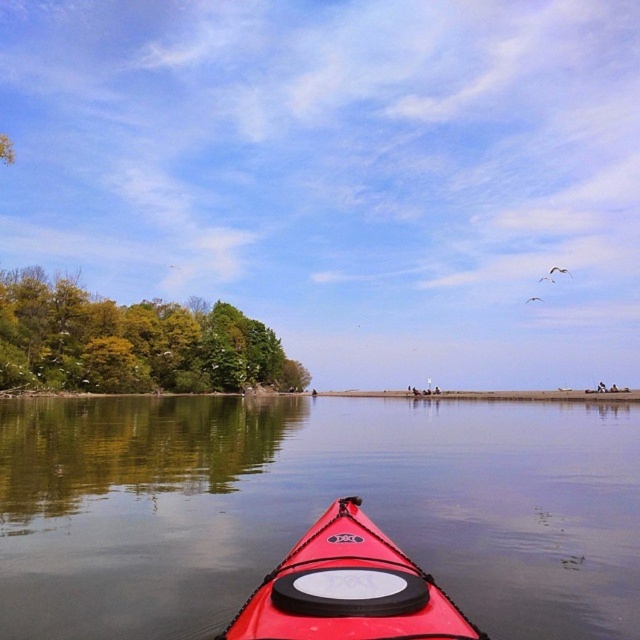
Question: Does red plastic kayak at center have a smaller size compared to green leafy trees at left?

Choices:
 (A) yes
 (B) no

Answer: (A)

Question: Can you confirm if red plastic kayak at center is wider than green leafy trees at left?

Choices:
 (A) yes
 (B) no

Answer: (A)

Question: Which of the following is the farthest from the observer?

Choices:
 (A) (90, 552)
 (B) (116, 385)

Answer: (B)

Question: Which point appears farthest from the camera in this image?

Choices:
 (A) (259, 337)
 (B) (397, 552)
 (C) (580, 451)

Answer: (A)

Question: Observing the image, what is the correct spatial positioning of red plastic kayak at center in reference to green leafy trees at left?

Choices:
 (A) left
 (B) right

Answer: (B)

Question: Which object appears closest to the camera in this image?

Choices:
 (A) shiny red canoe at center
 (B) green leafy trees at left
 (C) red plastic kayak at center

Answer: (A)